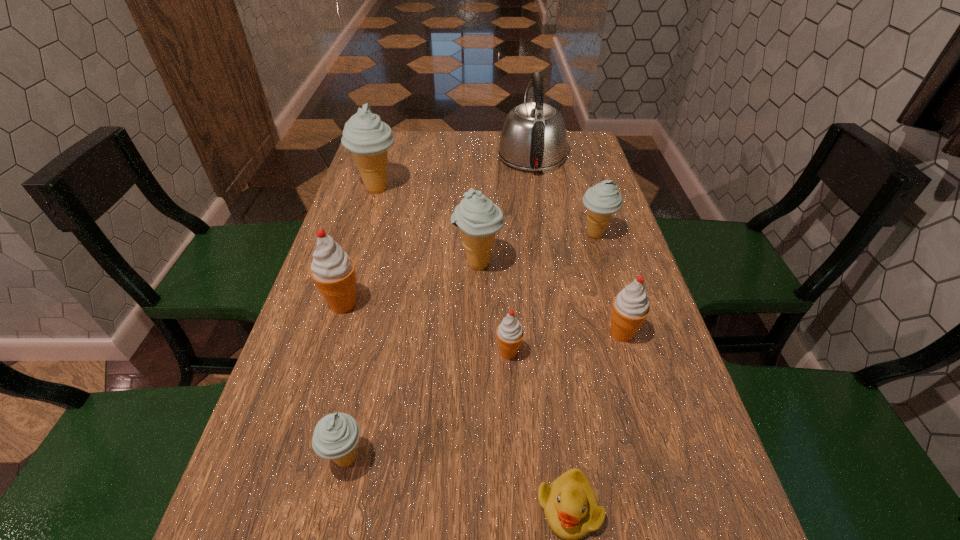
At what (x,y) coordinates should I click in order to perform the action: click on the closest red icecream relative to the fifth nearest object. Please return your answer as a coordinate pair (x, y). Looking at the image, I should click on (510, 333).

Find the location of a particular element. free spot that satisfies the following two spatial constraints: 1. on the front side of the farthest red icecream; 2. on the left side of the second red icecream from left to right is located at coordinates (328, 353).